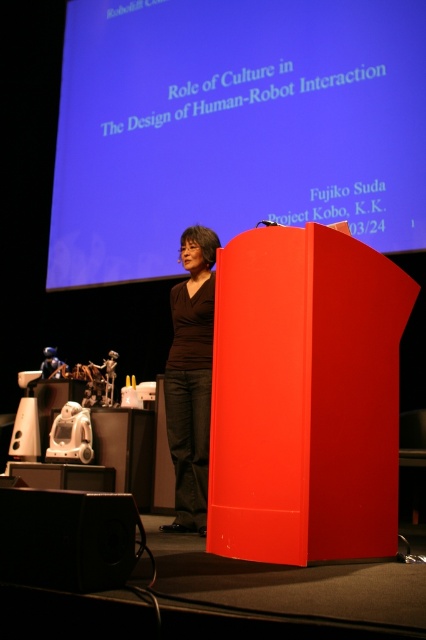
Question: Considering the real-world distances, which object is farthest from the black matte speaker at lower left?

Choices:
 (A) blue matte projection screen at upper center
 (B) brown matte shirt at center

Answer: (A)

Question: Is black matte speaker at lower left above brown matte shirt at center?

Choices:
 (A) no
 (B) yes

Answer: (A)

Question: Is blue matte projection screen at upper center closer to the viewer compared to brown matte shirt at center?

Choices:
 (A) no
 (B) yes

Answer: (A)

Question: Does blue matte projection screen at upper center come in front of brown matte shirt at center?

Choices:
 (A) no
 (B) yes

Answer: (A)

Question: Which point is farther to the camera?

Choices:
 (A) (351, 168)
 (B) (172, 326)
 (C) (111, 532)

Answer: (B)

Question: Which of the following is the closest to the observer?

Choices:
 (A) (45, 584)
 (B) (100, 177)
 (C) (189, 513)

Answer: (A)